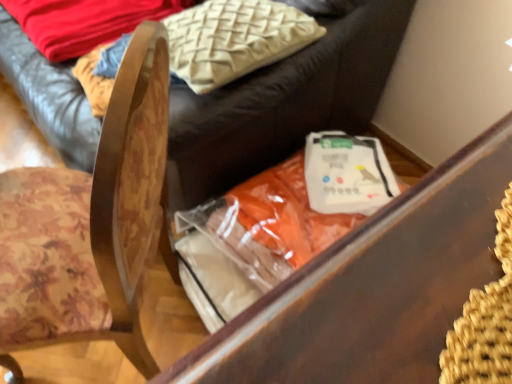
Question: In terms of width, does beige textured pillow at upper center look wider or thinner when compared to orange fabric bag at center, which is counted as the second furniture, starting from the top?

Choices:
 (A) thin
 (B) wide

Answer: (A)

Question: Is beige textured pillow at upper center to the left or to the right of orange fabric bag at center, arranged as the 1th furniture when ordered from the bottom, in the image?

Choices:
 (A) right
 (B) left

Answer: (B)

Question: Which is farther from the wooden chair at lower left, the second furniture ordered from the bottom?

Choices:
 (A) beige textured pillow at upper center
 (B) wooden chair at center
 (C) white matte plastic bag at center
 (D) orange fabric bag at center, arranged as the 1th furniture when ordered from the bottom

Answer: (D)

Question: Which of these objects is positioned farthest from the wooden chair at lower left, the second furniture ordered from the bottom?

Choices:
 (A) beige textured pillow at upper center
 (B) wooden chair at center
 (C) orange fabric bag at center, arranged as the 1th furniture when ordered from the bottom
 (D) white matte plastic bag at center

Answer: (C)